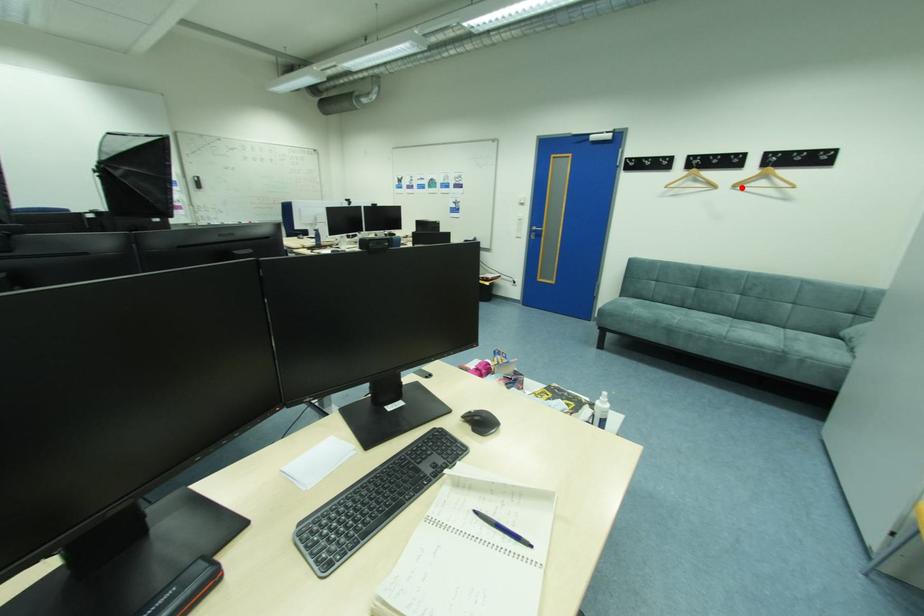
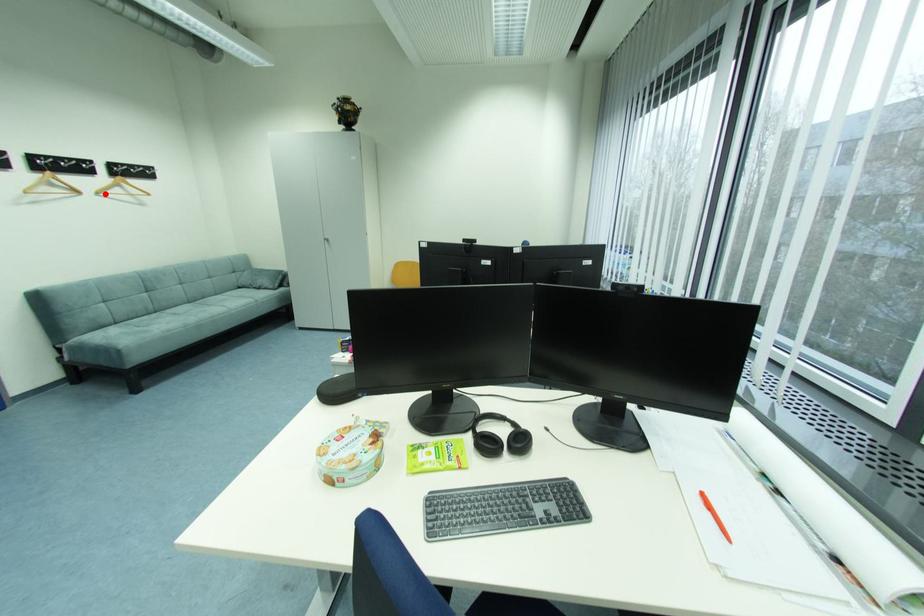
I am providing you with two images of the same scene from different viewpoints. A red point is marked on the first image and another point is marked on the second image. Is the marked point in image1 the same physical position as the marked point in image2?

Yes